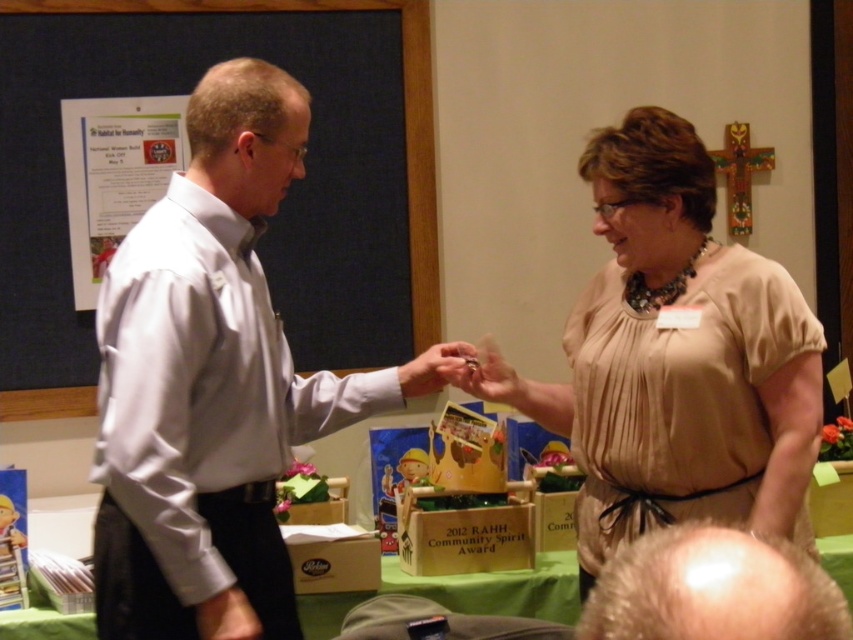
You are a photographer at the event and want to capture a photo that includes both the blue fabric bulletin board at upper left and the metallic ring at center. Which object should you position closer to the left side of the frame to ensure both are visible?

To ensure both the blue fabric bulletin board at upper left and the metallic ring at center are visible, position the blue fabric bulletin board at upper left closer to the left side of the frame since it is already on the left side of the metallic ring at center.

You are an event planner who needs to place a 1.2 meter long banner between the blue fabric bulletin board at upper left and the metallic ring at center. Will the banner fit between them?

The blue fabric bulletin board at upper left is 1.15 meters from the metallic ring at center. Since the banner is 1.2 meters long, it will not fit between them as the distance is slightly shorter than the banner.

You are a photographer at the event and want to capture a closeup of the blonde hair at lower right. The camera you are using has a focal length of 50mm. To ensure the subject is in focus, you need to know the distance between the camera and the point marked at point (712, 589). Can you determine the distance?

The point (712, 589) marks the blonde hair at lower right, but without additional information about the camera sensor size or the subject distance, it is impossible to calculate the exact distance required for the focal length of 50mm.